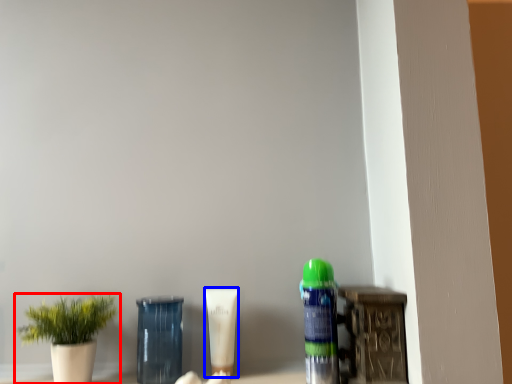
Question: Which object appears closest to the camera in this image, houseplant (highlighted by a red box) or product (highlighted by a blue box)?

Choices:
 (A) houseplant
 (B) product

Answer: (A)